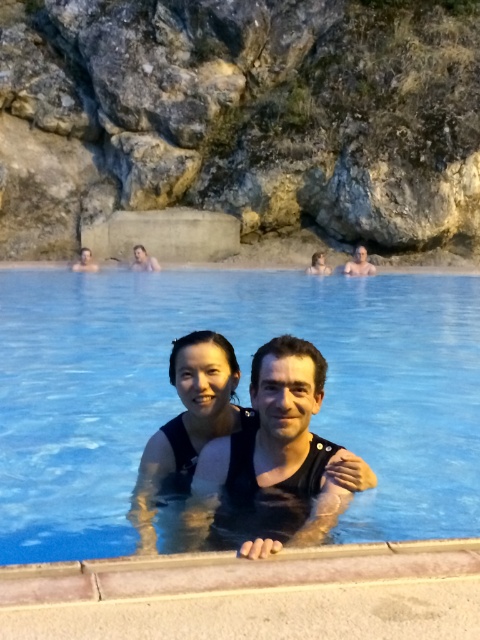
You are standing at the edge of the hot spring and want to take a photo of the two people in the water. You notice two specific points marked as point 1 at coordinates (x=96, y=444) and point 2 at coordinates (x=76, y=268). Which point should you focus on to ensure the person closer to the front is in sharp focus?

You should focus on point 1 at coordinates (x=96, y=444) because it is in front of point 2 at coordinates (x=76, y=268), meaning the person near point 1 is closer and will be in focus if you focus there.

You are a photographer trying to capture a clear shot of both the matte black swimsuit at center and the matte black man at upper center. Since both are in the water, you need to adjust your focus. Which object should you focus on first to ensure it appears larger in the photo?

The matte black swimsuit at center is smaller than the matte black man at upper center. To ensure the swimsuit appears larger in the photo, focus on the matte black swimsuit at center first.